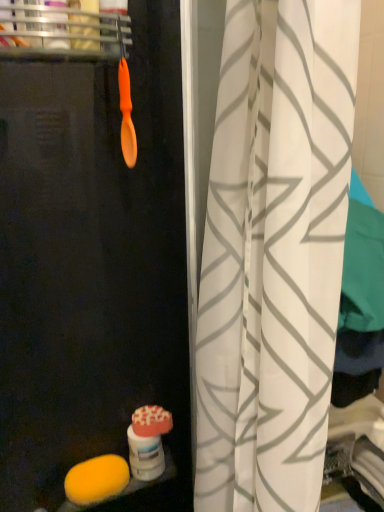
In order to face transparent plastic screen door at center, should I rotate leftwards or rightwards?

You should look left and rotate roughly 5.367 degrees.

Identify the location of white fabric curtain at center. This screenshot has height=512, width=384. (274, 252).

The height and width of the screenshot is (512, 384). What do you see at coordinates (126, 116) in the screenshot?
I see `orange matte spoon at upper left` at bounding box center [126, 116].

What is the approximate height of orange matte spoon at upper left?

The height of orange matte spoon at upper left is 8.91 inches.

Where is `transparent plastic screen door at center`? transparent plastic screen door at center is located at coordinates (92, 267).

Is orange plastic spoon at upper left completely or partially outside of orange matte spoon at upper left?

orange plastic spoon at upper left lies outside orange matte spoon at upper left's area.

From a real-world perspective, who is located lower, orange plastic spoon at upper left or orange matte spoon at upper left?

In real-world perspective, orange matte spoon at upper left is lower.

Is orange matte spoon at upper left at the back of orange plastic spoon at upper left?

That's not correct — orange plastic spoon at upper left is not looking away from orange matte spoon at upper left.

How far apart are orange plastic spoon at upper left and orange matte spoon at upper left?

orange plastic spoon at upper left and orange matte spoon at upper left are 5.04 inches apart from each other.

Which object is positioned more to the right, orange matte spoon at upper left or white fabric curtain at center?

Positioned to the right is white fabric curtain at center.

Could you tell me if orange matte spoon at upper left is facing white fabric curtain at center?

Yes, orange matte spoon at upper left is turned towards white fabric curtain at center.

Which is nearer, (x=128, y=117) or (x=309, y=391)?

Point (x=309, y=391)

Locate an element on the screen. The image size is (384, 512). curtain below the orange matte spoon at upper left (from a real-world perspective) is located at coordinates (274, 252).

What's the angular difference between yellow sponge at lower left and orange plastic spoon at upper left's facing directions?

There is a 0.00833-degree angle between the facing directions of yellow sponge at lower left and orange plastic spoon at upper left.

Is orange plastic spoon at upper left completely or partially inside yellow sponge at lower left?

No.

Consider the image. Who is bigger, yellow sponge at lower left or orange plastic spoon at upper left?

orange plastic spoon at upper left.

Which is closer to the camera, (107,466) or (64,47)?

Point (107,466) is positioned farther from the camera compared to point (64,47).

How distant is transparent plastic screen door at center from orange plastic spoon at upper left?

The distance of transparent plastic screen door at center from orange plastic spoon at upper left is 16.54 inches.

Is transparent plastic screen door at center in front of or behind orange plastic spoon at upper left in the image?

Visually, transparent plastic screen door at center is located in front of orange plastic spoon at upper left.

Does transparent plastic screen door at center have a greater width compared to orange plastic spoon at upper left?

Yes.

From the image's perspective, is transparent plastic screen door at center located above orange plastic spoon at upper left?

No, from the image's perspective, transparent plastic screen door at center is not on top of orange plastic spoon at upper left.

In the scene shown: From a real-world perspective, relative to transparent plastic screen door at center, is white fabric curtain at center vertically above or below?

From a real-world perspective, white fabric curtain at center is physically above transparent plastic screen door at center.

Is white fabric curtain at center behind transparent plastic screen door at center?

Yes, white fabric curtain at center is behind transparent plastic screen door at center.

Is point (227, 391) less distant than point (172, 297)?

Yes, it is in front of point (172, 297).

I want to click on screen door located on the left of white fabric curtain at center, so click(x=92, y=267).

From a real-world perspective, is yellow sponge at lower left on top of white fabric curtain at center?

Incorrect, from a real-world perspective, yellow sponge at lower left is lower than white fabric curtain at center.

Identify the location of food located on the left of white fabric curtain at center. (96, 480).

Considering the positions of points (117, 476) and (284, 343), is point (117, 476) farther from camera compared to point (284, 343)?

Yes.

Is point (265, 200) farther from viewer compared to point (121, 91)?

That is False.

Considering the relative sizes of white fabric curtain at center and orange matte spoon at upper left in the image provided, is white fabric curtain at center bigger than orange matte spoon at upper left?

Yes.

Is white fabric curtain at center positioned with its back to orange matte spoon at upper left?

No, white fabric curtain at center is not facing the opposite direction of orange matte spoon at upper left.

Measure the distance between white fabric curtain at center and orange matte spoon at upper left.

A distance of 18.49 inches exists between white fabric curtain at center and orange matte spoon at upper left.

Locate an element on the screen. The image size is (384, 512). brush that appears behind the orange plastic spoon at upper left is located at coordinates (126, 116).

Find the location of a particular element. brush above the white fabric curtain at center (from the image's perspective) is located at coordinates (126, 116).

From the image, which object appears to be nearer to yellow sponge at lower left, transparent plastic screen door at center or white fabric curtain at center?

Based on the image, transparent plastic screen door at center appears to be nearer to yellow sponge at lower left.

Considering their positions, is orange plastic spoon at upper left positioned further to orange matte spoon at upper left than yellow sponge at lower left?

Based on the image, yellow sponge at lower left appears to be further to orange matte spoon at upper left.

Which object lies further to the anchor point yellow sponge at lower left, white fabric curtain at center or orange matte spoon at upper left?

orange matte spoon at upper left lies further to yellow sponge at lower left than the other object.

Estimate the real-world distances between objects in this image. Which object is closer to orange matte spoon at upper left, orange plastic spoon at upper left or white fabric curtain at center?

Among the two, orange plastic spoon at upper left is located nearer to orange matte spoon at upper left.

From the image, which object appears to be farther from orange matte spoon at upper left, transparent plastic screen door at center or white fabric curtain at center?

The object further to orange matte spoon at upper left is white fabric curtain at center.

In the scene shown: Estimate the real-world distances between objects in this image. Which object is closer to white fabric curtain at center, transparent plastic screen door at center or orange plastic spoon at upper left?

transparent plastic screen door at center is positioned closer to the anchor white fabric curtain at center.

From the image, which object appears to be farther from yellow sponge at lower left, orange matte spoon at upper left or orange plastic spoon at upper left?

orange plastic spoon at upper left is positioned further to the anchor yellow sponge at lower left.

Looking at the image, which one is located closer to orange matte spoon at upper left, white fabric curtain at center or orange plastic spoon at upper left?

The object closer to orange matte spoon at upper left is orange plastic spoon at upper left.

This screenshot has height=512, width=384. I want to click on curtain between transparent plastic screen door at center and yellow sponge at lower left from front to back, so click(x=274, y=252).

Identify the location of curtain positioned between transparent plastic screen door at center and orange matte spoon at upper left from near to far. (274, 252).

The height and width of the screenshot is (512, 384). What are the coordinates of `brush located between transparent plastic screen door at center and yellow sponge at lower left in the depth direction` in the screenshot? It's located at (126, 116).

Identify the location of curtain between orange matte spoon at upper left and yellow sponge at lower left from top to bottom. (274, 252).